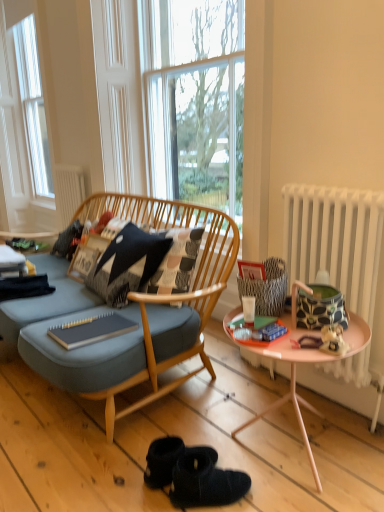
Question: Which direction should I rotate to look at matte gray notebook at center, the second magazine in the front-to-back sequence?

Choices:
 (A) left
 (B) right

Answer: (A)

Question: From a real-world perspective, is clear glass window at center physically above matte green magazine at center, the 1th magazine in the right-to-left sequence?

Choices:
 (A) yes
 (B) no

Answer: (A)

Question: Is clear glass window at center outside matte green magazine at center, the second magazine when ordered from back to front?

Choices:
 (A) no
 (B) yes

Answer: (B)

Question: Is clear glass window at center further to the viewer compared to matte green magazine at center, the second magazine in the left-to-right sequence?

Choices:
 (A) no
 (B) yes

Answer: (B)

Question: Can you confirm if clear glass window at center is wider than matte green magazine at center, the second magazine when ordered from back to front?

Choices:
 (A) no
 (B) yes

Answer: (A)

Question: Is clear glass window at center positioned before matte green magazine at center, which ranks as the 1th magazine in front-to-back order?

Choices:
 (A) yes
 (B) no

Answer: (B)

Question: Can you confirm if clear glass window at center is taller than matte green magazine at center, the second magazine in the left-to-right sequence?

Choices:
 (A) no
 (B) yes

Answer: (B)

Question: From the image's perspective, is black textured pillow at center under matte green magazine at center, the second magazine when ordered from back to front?

Choices:
 (A) no
 (B) yes

Answer: (A)

Question: Is black textured pillow at center touching matte green magazine at center, the second magazine when ordered from back to front?

Choices:
 (A) no
 (B) yes

Answer: (A)

Question: From a real-world perspective, is black textured pillow at center under matte green magazine at center, the 1th magazine in the right-to-left sequence?

Choices:
 (A) yes
 (B) no

Answer: (B)

Question: Is black textured pillow at center bigger than matte green magazine at center, which ranks as the 1th magazine in front-to-back order?

Choices:
 (A) yes
 (B) no

Answer: (A)

Question: From the image's perspective, is black textured pillow at center located above matte green magazine at center, the second magazine when ordered from back to front?

Choices:
 (A) no
 (B) yes

Answer: (B)

Question: Is black textured pillow at center far away from matte green magazine at center, the second magazine in the left-to-right sequence?

Choices:
 (A) yes
 (B) no

Answer: (B)

Question: Is matte green magazine at center, the second magazine in the left-to-right sequence, wider than black textured pillow at center?

Choices:
 (A) no
 (B) yes

Answer: (B)